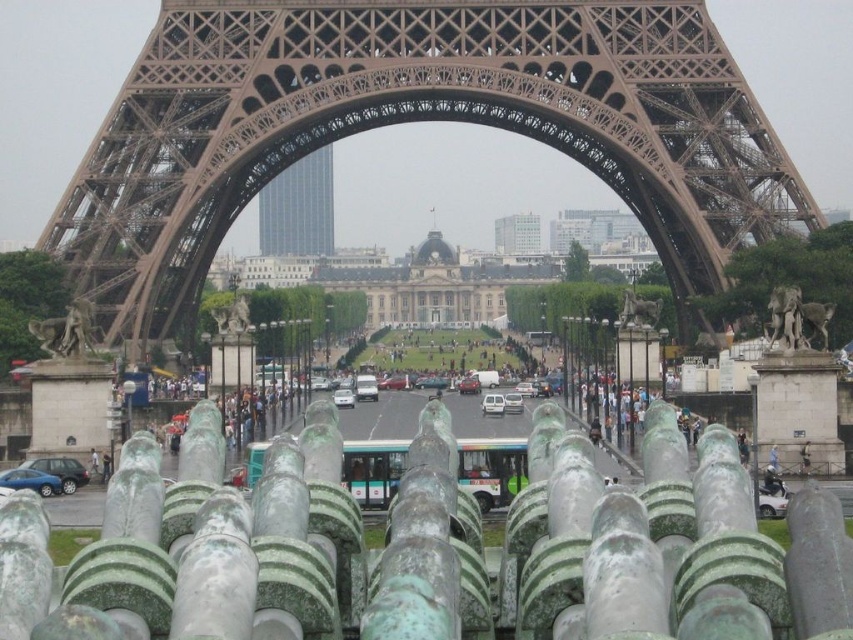
You are standing in front of the cannons in the foreground of the Eiffel Tower image. If you look straight ahead, will you see the brown metal eiffel tower at center?

Yes, because the brown metal eiffel tower at center is located at point (413, 120), which is directly in front of you when looking straight ahead.

You are a photographer standing in front of the Eiffel Tower. You have two cars in your shot, a matte green car at lower left and a silver metallic car at center. Which car appears narrower in the photo?

The matte green car at lower left appears narrower than the silver metallic car at center in the photo.

You are standing at the base of the brown metal Eiffel Tower at center and want to take a photo of it with your camera. The camera requires you to be at least 400 feet away to capture the entire structure in one frame. Can you achieve this without moving your camera?

The brown metal Eiffel Tower at center and the camera are 433.22 feet apart, which is more than the required 400 feet. Therefore, you can capture the entire structure in one frame without moving the camera.